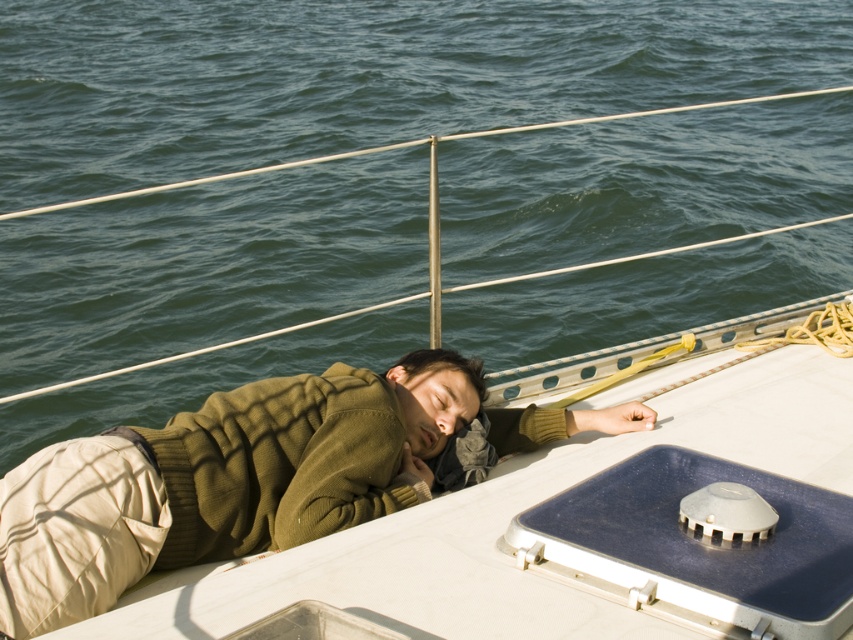
Question: Is green water at center wider than green knitted sweater at center?

Choices:
 (A) yes
 (B) no

Answer: (A)

Question: Can you confirm if green water at center is positioned to the left of green knitted sweater at center?

Choices:
 (A) yes
 (B) no

Answer: (A)

Question: Is the position of green water at center less distant than that of green knitted sweater at center?

Choices:
 (A) no
 (B) yes

Answer: (A)

Question: Which point is closer to the camera?

Choices:
 (A) green knitted sweater at center
 (B) green water at center

Answer: (A)

Question: Which point is farther to the camera?

Choices:
 (A) green water at center
 (B) green knitted sweater at center

Answer: (A)